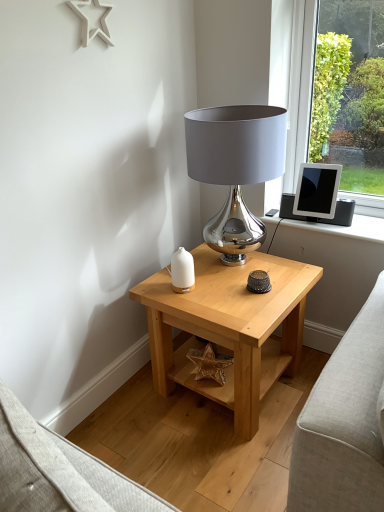
At what (x,y) coordinates should I click in order to perform the action: click on vacant space underneath shiny metallic lamp at upper center (from a real-world perspective). Please return your answer as a coordinate pair (x, y). The height and width of the screenshot is (512, 384). Looking at the image, I should click on (236, 266).